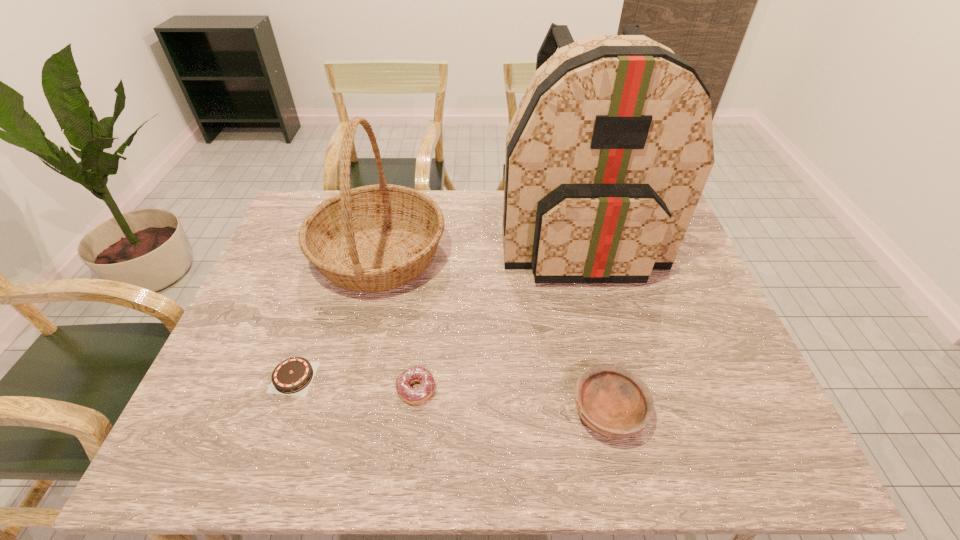
This screenshot has width=960, height=540. Find the location of `the tallest object`. the tallest object is located at coordinates (607, 155).

Identify the location of basket. The width and height of the screenshot is (960, 540). (373, 238).

Locate an element on the screen. the third tallest object is located at coordinates (612, 401).

Where is `doughnut`? doughnut is located at coordinates (413, 395).

Identify the location of the shortest object. (293, 376).

The height and width of the screenshot is (540, 960). I want to click on vacant point located 0.140m on the front face of the backpack, so click(x=602, y=329).

Locate an element on the screen. Image resolution: width=960 pixels, height=540 pixels. blank space located on the front of the basket is located at coordinates click(355, 354).

The width and height of the screenshot is (960, 540). Find the location of `free space located 0.280m on the back of the third shortest object`. free space located 0.280m on the back of the third shortest object is located at coordinates (582, 292).

Where is `free region located 0.210m on the right of the fourth tallest object`? free region located 0.210m on the right of the fourth tallest object is located at coordinates (528, 389).

Locate an element on the screen. This screenshot has height=540, width=960. vacant space located 0.320m on the right of the shortest object is located at coordinates (452, 377).